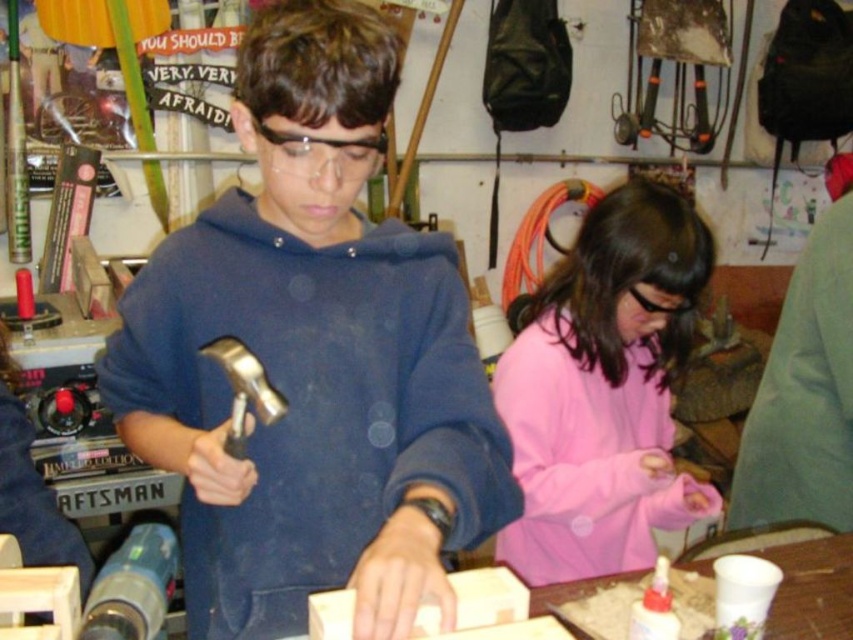
Which is above, metallic hammer at center or pink fabric at lower right?

Positioned higher is metallic hammer at center.

Is metallic hammer at center shorter than pink fabric at lower right?

In fact, metallic hammer at center may be taller than pink fabric at lower right.

Is point (317, 285) farther from camera compared to point (628, 513)?

No, (317, 285) is in front of (628, 513).

Identify the location of metallic hammer at center. This screenshot has height=640, width=853. (312, 356).

Is metallic hammer at center taller than gold metallic hammer at center?

Yes, metallic hammer at center is taller than gold metallic hammer at center.

At what (x,y) coordinates should I click in order to perform the action: click on metallic hammer at center. Please return your answer as a coordinate pair (x, y). The height and width of the screenshot is (640, 853). Looking at the image, I should click on (312, 356).

Can you confirm if pink fabric at lower right is taller than gold metallic hammer at center?

Indeed, pink fabric at lower right has a greater height compared to gold metallic hammer at center.

What do you see at coordinates (604, 390) in the screenshot?
I see `pink fabric at lower right` at bounding box center [604, 390].

Describe the element at coordinates (604, 390) in the screenshot. I see `pink fabric at lower right` at that location.

Where is `pink fabric at lower right`? pink fabric at lower right is located at coordinates (604, 390).